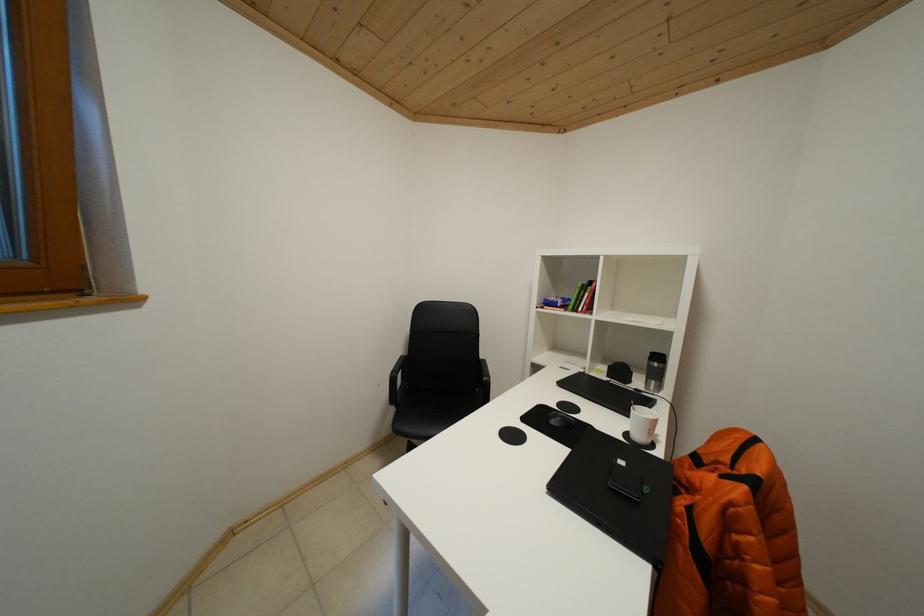
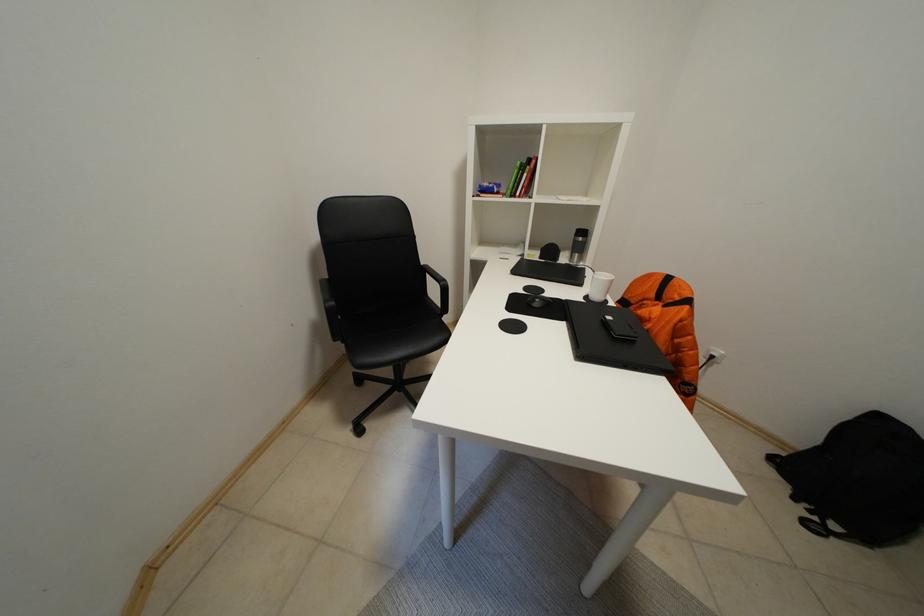
First-person continuous shooting, in which direction is the camera rotating?

The camera's rotation is toward right-down.